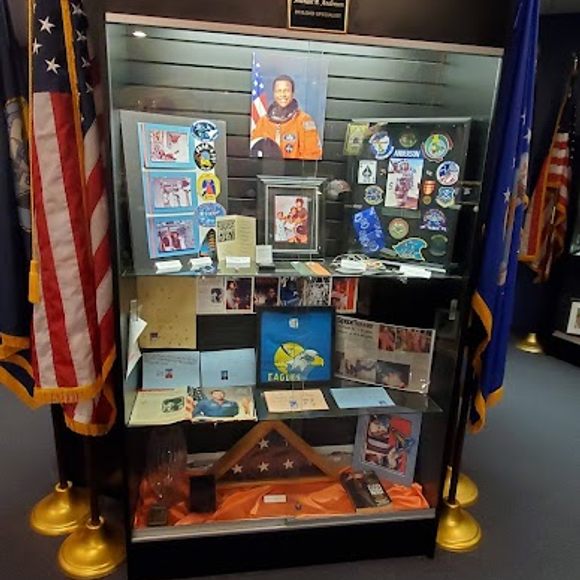
Where is `magazine`? The width and height of the screenshot is (580, 580). magazine is located at coordinates (182, 409).